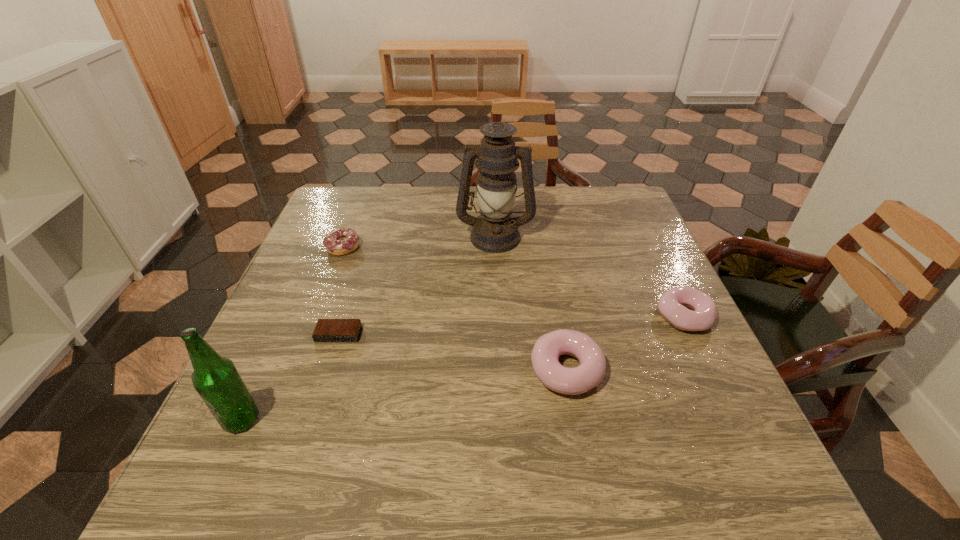
Identify which object is the second nearest to the tallest doughnut. Please provide its 2D coordinates. Your answer should be formatted as a tuple, i.e. [(x, y)], where the tuple contains the x and y coordinates of a point satisfying the conditions above.

[(495, 231)]

Identify which object is the second nearest to the rightmost object. Please provide its 2D coordinates. Your answer should be formatted as a tuple, i.e. [(x, y)], where the tuple contains the x and y coordinates of a point satisfying the conditions above.

[(495, 231)]

Choose which doughnut is the nearest neighbor to the nearest object. Please provide its 2D coordinates. Your answer should be formatted as a tuple, i.e. [(x, y)], where the tuple contains the x and y coordinates of a point satisfying the conditions above.

[(341, 241)]

Point out which doughnut is positioned as the third nearest to the shortest object. Please provide its 2D coordinates. Your answer should be formatted as a tuple, i.e. [(x, y)], where the tuple contains the x and y coordinates of a point satisfying the conditions above.

[(672, 304)]

Find the location of a particular element. Image resolution: width=960 pixels, height=540 pixels. blank space that satisfies the following two spatial constraints: 1. on the front face of the second doughnut from right to left; 2. on the right side of the alarm clock is located at coordinates (327, 369).

You are a GUI agent. You are given a task and a screenshot of the screen. Output one action in this format:
    pyautogui.click(x=<x>, y=<y>)
    Task: Click on the vacant space that satisfies the following two spatial constraints: 1. on the front side of the leftmost doughnut; 2. on the left side of the fourth shortest object
    This screenshot has height=540, width=960.
    Given the screenshot: What is the action you would take?
    pyautogui.click(x=296, y=369)

Image resolution: width=960 pixels, height=540 pixels. In order to click on vacant space that satisfies the following two spatial constraints: 1. on the back side of the shortest doughnut; 2. on the right side of the tallest object in this screenshot , I will do `click(348, 236)`.